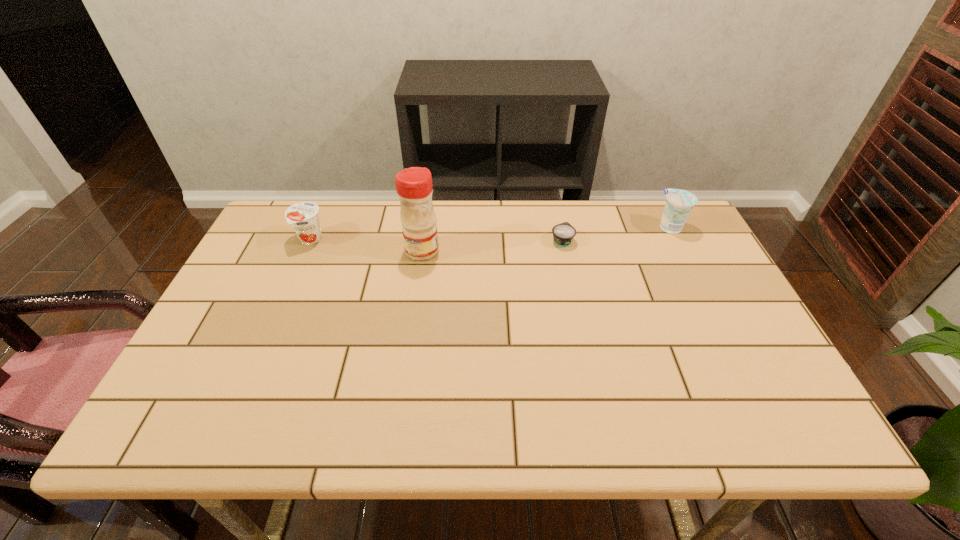
Find the location of a particular element. This screenshot has width=960, height=540. the second object from left to right is located at coordinates (414, 188).

Where is `the tallest object`? The height and width of the screenshot is (540, 960). the tallest object is located at coordinates (414, 188).

You are a GUI agent. You are given a task and a screenshot of the screen. Output one action in this format:
    pyautogui.click(x=<x>, y=<y>)
    Task: Click on the rightmost yogurt
    The height and width of the screenshot is (540, 960).
    Given the screenshot: What is the action you would take?
    pyautogui.click(x=679, y=203)

Locate an element on the screen. The image size is (960, 540). the leftmost yogurt is located at coordinates (303, 216).

Locate an element on the screen. This screenshot has width=960, height=540. the second yogurt from right to left is located at coordinates (563, 234).

Where is `the shortest yogurt`? the shortest yogurt is located at coordinates (563, 234).

The image size is (960, 540). I want to click on free location located 0.390m on the right of the condiment, so click(x=571, y=251).

This screenshot has height=540, width=960. In order to click on vacant space situated 0.390m on the left of the rightmost yogurt in this screenshot , I will do `click(531, 227)`.

Find the location of a particular element. blank space located 0.060m on the back of the leftmost yogurt is located at coordinates (321, 218).

The width and height of the screenshot is (960, 540). I want to click on free space located 0.270m on the front of the second yogurt from left to right, so click(x=579, y=319).